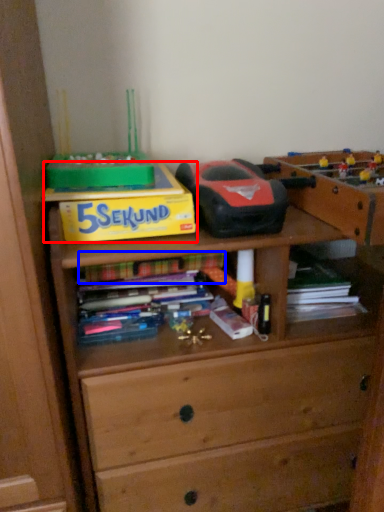
Question: Which of the following is the farthest to the observer, paperback book (highlighted by a red box) or book (highlighted by a blue box)?

Choices:
 (A) paperback book
 (B) book

Answer: (B)